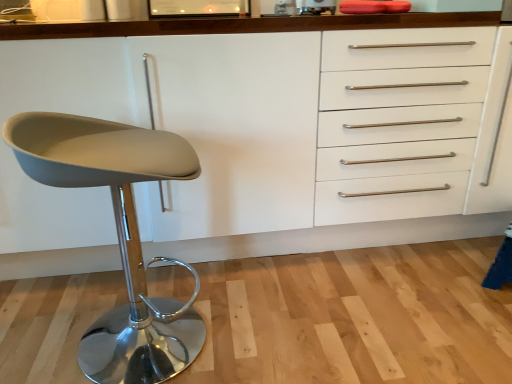
The width and height of the screenshot is (512, 384). Find the location of `unoccupied space behind matte gray seat at left`. unoccupied space behind matte gray seat at left is located at coordinates (175, 285).